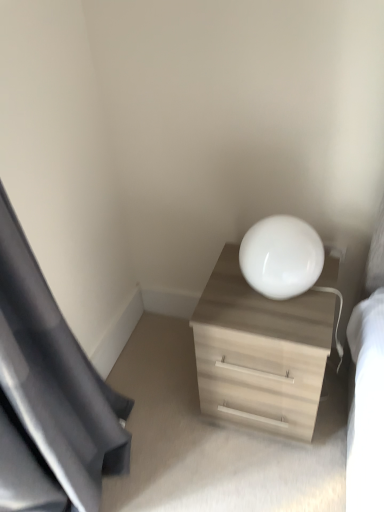
What are the coordinates of `free space above light wood dresser at center (from a real-world perspective)` in the screenshot? It's located at (266, 306).